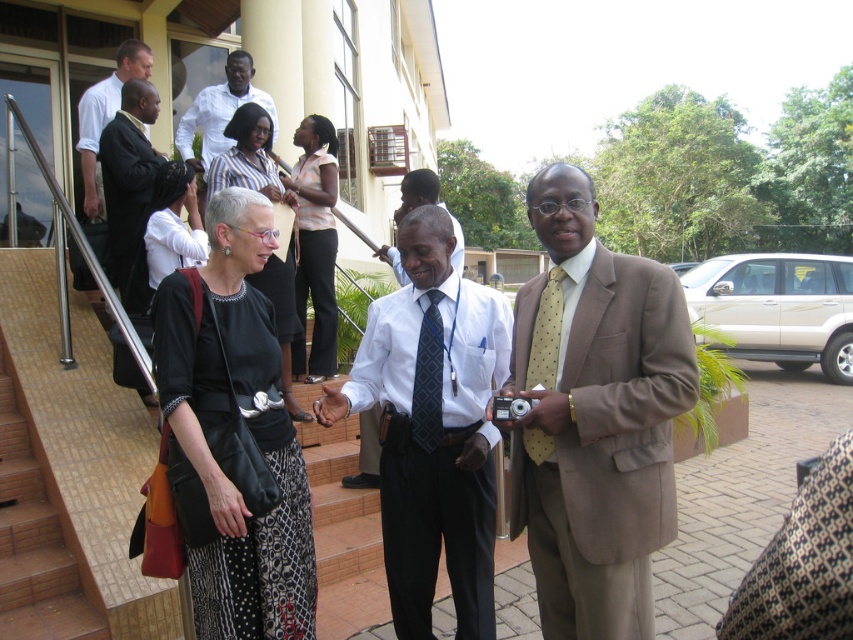
You are a photographer at the event and want to ensure the black fabric dress at center and the matte pink blouse at center are both visible in your photo. Based on their positions, which one is closer to the camera?

The black fabric dress at center is in front of the matte pink blouse at center, so it is closer to the camera.

You are standing at the bottom of the brown tile stairs at lower left and want to reach the black satin dress at center. Which direction should you move to get closer to the dress?

The brown tile stairs at lower left is in front of the black satin dress at center, so to get closer to the dress, you should move backward away from the stairs.